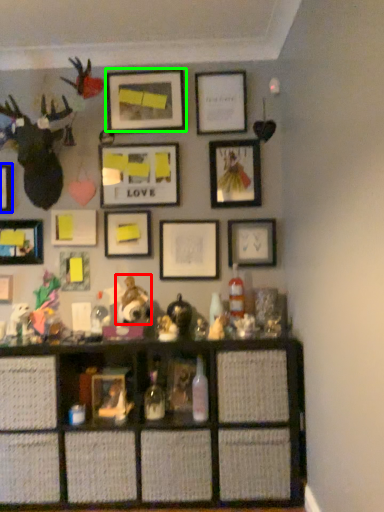
Question: Which object is positioned closest to toy (highlighted by a red box)? Select from picture frame (highlighted by a blue box) and picture frame (highlighted by a green box).

Choices:
 (A) picture frame
 (B) picture frame

Answer: (A)